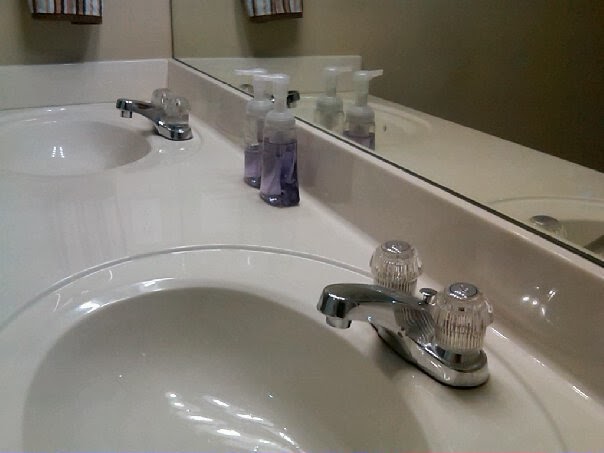
Find the location of a particular element. space between sinks is located at coordinates (124, 223).